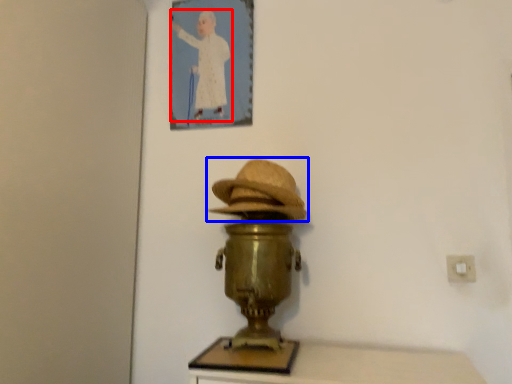
Question: Among these objects, which one is farthest to the camera, person (highlighted by a red box) or hat (highlighted by a blue box)?

Choices:
 (A) person
 (B) hat

Answer: (A)